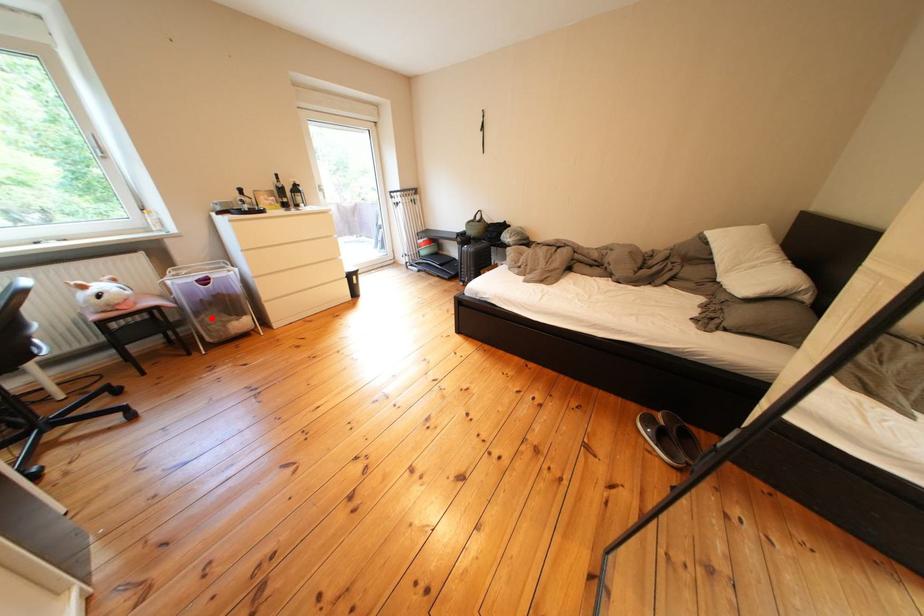
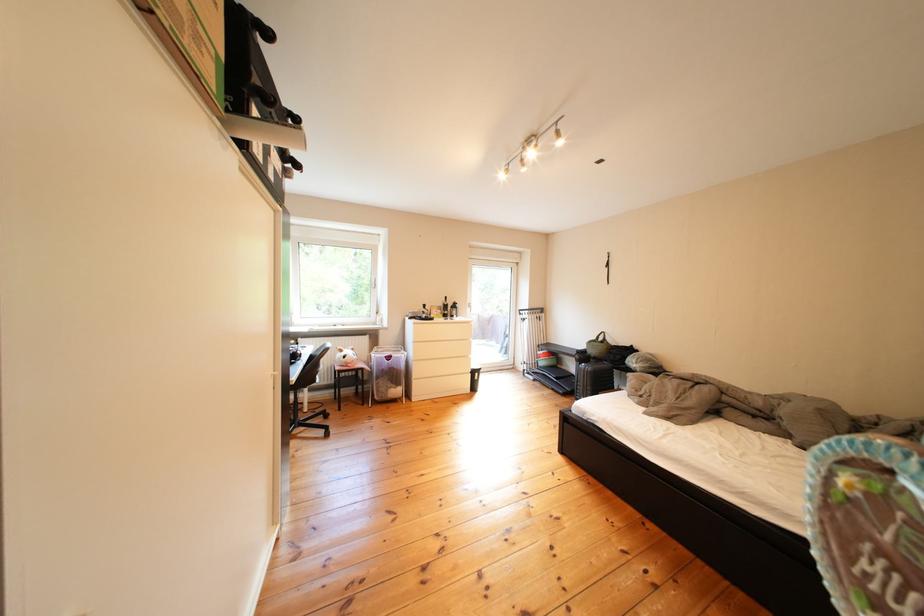
The point at the highlighted location is marked in the first image. Where is the corresponding point in the second image?

(392, 382)